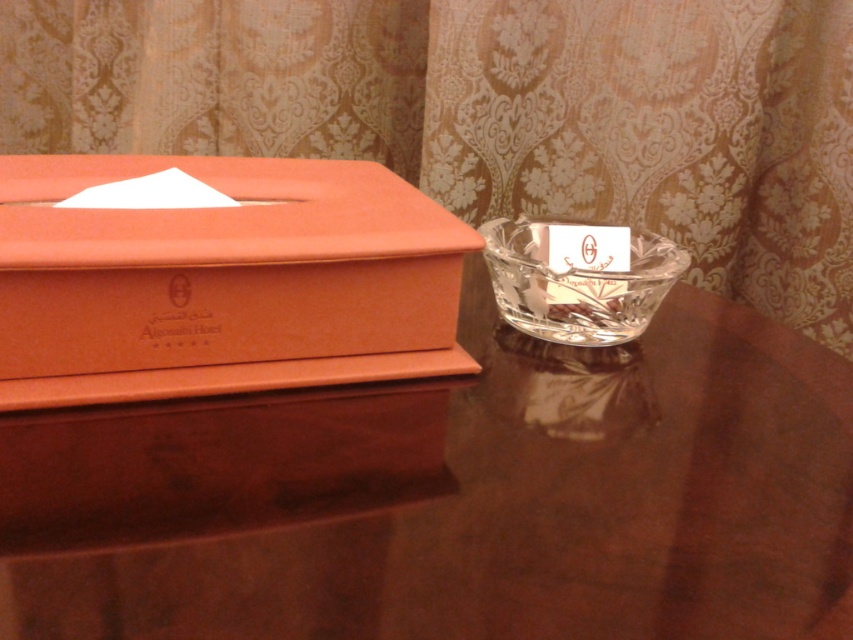
You are organizing items on a desk and see the brown glossy table at center and the orange cardboard tissue box at left. Which object is positioned to the right side of the other?

The brown glossy table at center is to the right of the orange cardboard tissue box at left.

You are standing in a hotel room and see two points marked on a desk. The first point is at coordinate point (772, 83) and the second is at point (688, 262). Which point is closer to you?

Point (772, 83) is closer to you because it is further to the viewer than point (688, 262).

You are a hotel guest who wants to place a 24 inch long decorative vase between the matte gold curtain at upper center and the orange cardboard tissue box at left. Is there enough space for the vase?

The distance between the matte gold curtain at upper center and the orange cardboard tissue box at left is 26.12 inches. Since the vase is 24 inches long, there is enough space to place it between them.